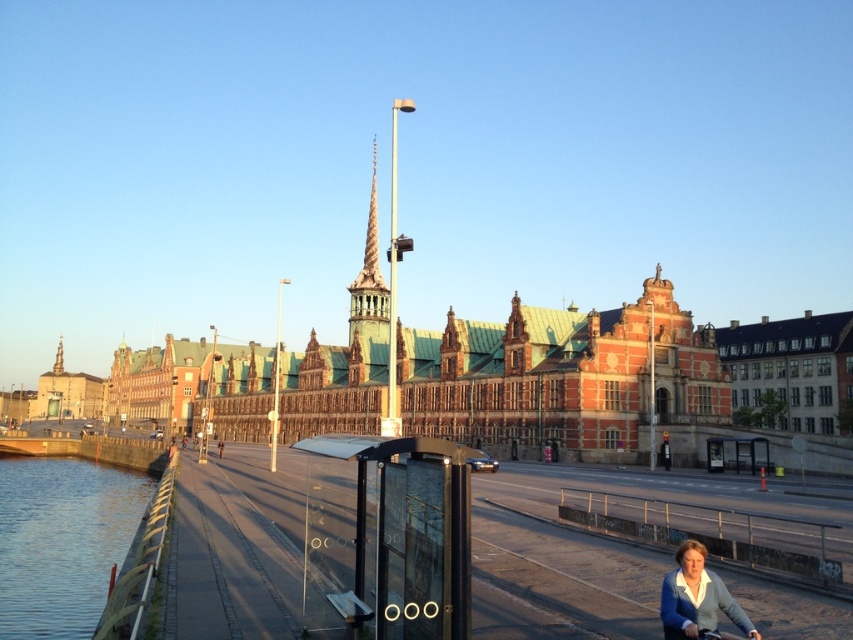
You are standing on the paved walkway and want to greet the person on the black matte bicycle at lower right without blocking their path. Since the light brown sweater at lower right is to the right of the bicycle, which side of the bicycle should you approach from?

You should approach from the left side of the black matte bicycle at lower right because the light brown sweater at lower right is to the right of the bicycle, meaning the right side is occupied by the sweater, leaving the left side clear for safe access.

Looking at this image, you are standing on the paved walkway and want to take a photo of both the clear water at lower left and the light brown sweater at lower right. Which object should you focus on first if you want to capture both in the same frame?

You should focus on the clear water at lower left first because it is positioned on the left side of the light brown sweater at lower right, so adjusting the camera to include both from left to right would start with the clear water at lower left.

You are a photographer standing at the center of the walkway. You want to take a photo of the historic building with the green roof. However, there is a person wearing a light brown sweater at lower right in your shot. Where should you move to avoid the person while keeping the building in frame?

Move to the left side of the walkway. Since the light brown sweater at lower right is located at coordinates approximately 0.934 on the x and 0.817 on the y axis, moving left would shift your perspective away from the person while still keeping the historic building with green roof in view.